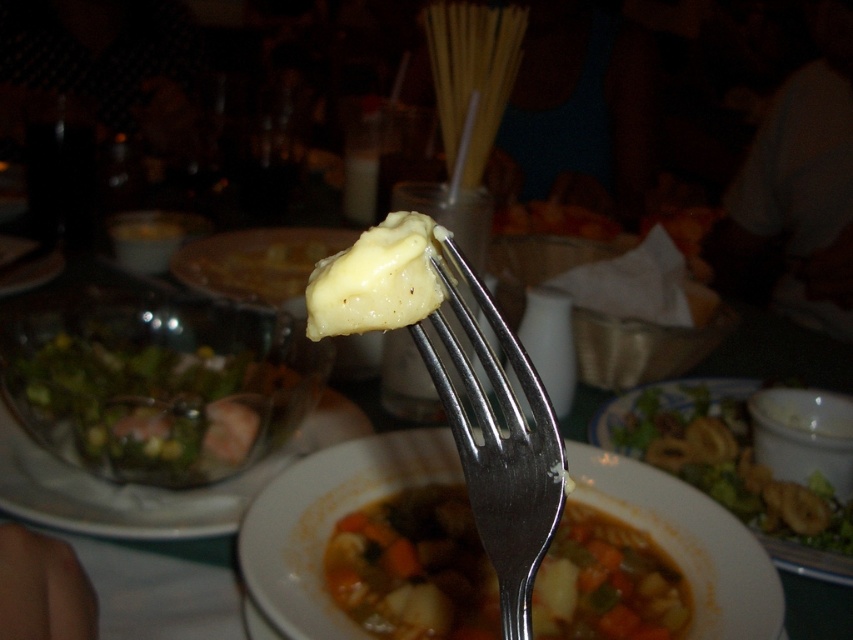
Between translucent glass bowl at center and yellow creamy cheese at fork tip, which one appears on the left side from the viewer's perspective?

From the viewer's perspective, yellow creamy cheese at fork tip appears more on the left side.

Can you confirm if translucent glass bowl at center is taller than yellow creamy cheese at fork tip?

No, translucent glass bowl at center is not taller than yellow creamy cheese at fork tip.

Does point (196, 536) come closer to viewer compared to point (258, 272)?

Yes.

The width and height of the screenshot is (853, 640). In order to click on translucent glass bowl at center in this screenshot , I will do `click(151, 486)`.

Does silver metallic fork at center appear on the left side of translucent glass bowl at center?

In fact, silver metallic fork at center is to the right of translucent glass bowl at center.

Between point (463, 428) and point (68, 502), which one is positioned behind?

Point (68, 502)

Identify the location of silver metallic fork at center. The image size is (853, 640). (498, 442).

Can you confirm if translucent glass bowl at center is taller than yellow creamy cheese at fork center?

Yes.

Can you confirm if translucent glass bowl at center is positioned above yellow creamy cheese at fork center?

No.

This screenshot has width=853, height=640. I want to click on translucent glass bowl at center, so [151, 486].